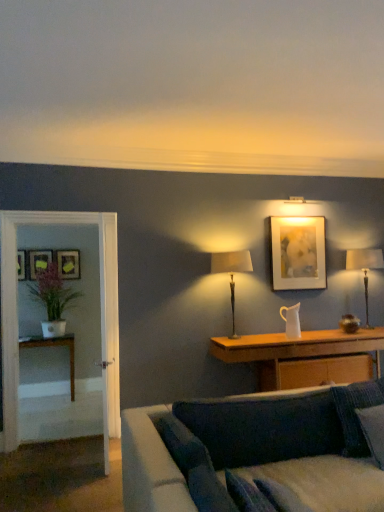
Find the location of a particular element. Image resolution: width=384 pixels, height=512 pixels. vacant space underneath clear glass door at left (from a real-world perspective) is located at coordinates (53, 441).